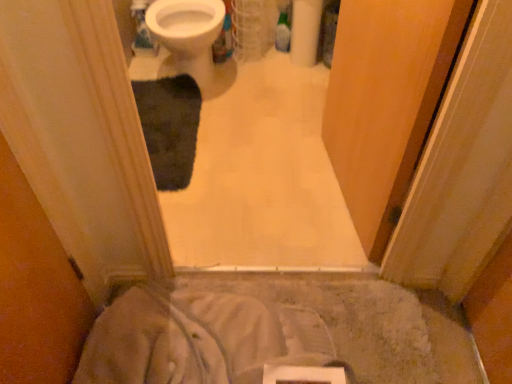
Question: From a real-world perspective, is white glossy bidet at upper center above or below white soft fabric at lower center?

Choices:
 (A) below
 (B) above

Answer: (B)

Question: Is point (199, 46) positioned closer to the camera than point (117, 322)?

Choices:
 (A) closer
 (B) farther

Answer: (B)

Question: Which object is the closest to the white glossy bidet at upper center?

Choices:
 (A) wooden screen door at center
 (B) dark gray plush bath mat at center
 (C) white soft fabric at lower center

Answer: (B)

Question: Which object is the closest to the white soft fabric at lower center?

Choices:
 (A) dark gray plush bath mat at center
 (B) wooden screen door at center
 (C) white glossy bidet at upper center

Answer: (B)